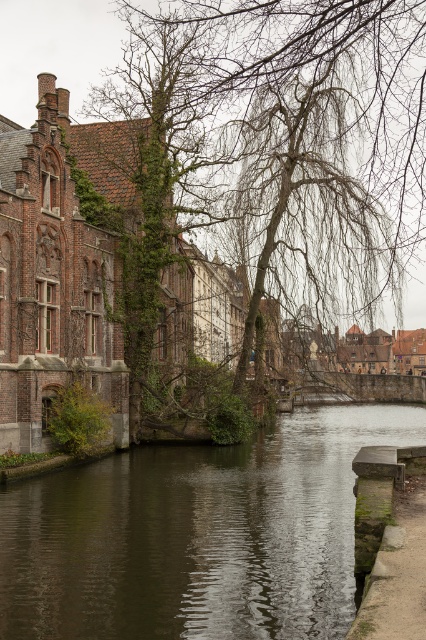
You are a tourist standing at the edge of the canal near the green mossy stone at lower right. You want to toss a small pebble into the dark brown water at center. Considering their relative heights, will the pebble reach the water if you throw it straight ahead?

The dark brown water at center is shorter than the green mossy stone at lower right. Since you are standing on the stone, which is higher, tossing the pebble forward would naturally allow it to reach the lower positioned water.

You are standing at the point marked by the coordinates point (196, 536) in the canal scene. Based on the scene description, what is the immediate environment around you?

The point (196, 536) is on dark brown water at center, so you are surrounded by water in the canal.

Based on the photo, you are standing at the edge of the canal and want to determine which of the two points, point (227, 13) or point (389, 540), is closer to you. Based on the scene description, which point is nearer?

Point (227, 13) is closer to you because it is further to the viewer than point (389, 540).